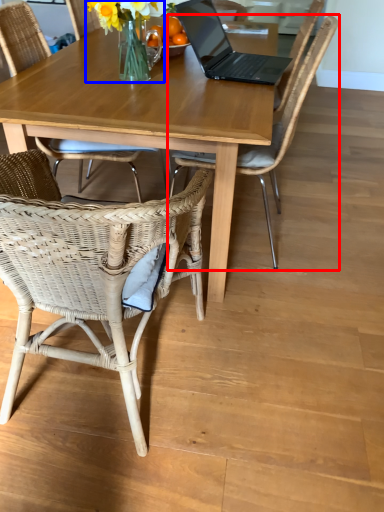
Question: Which point is further to the camera, chair (highlighted by a red box) or floral arrangement (highlighted by a blue box)?

Choices:
 (A) chair
 (B) floral arrangement

Answer: (B)